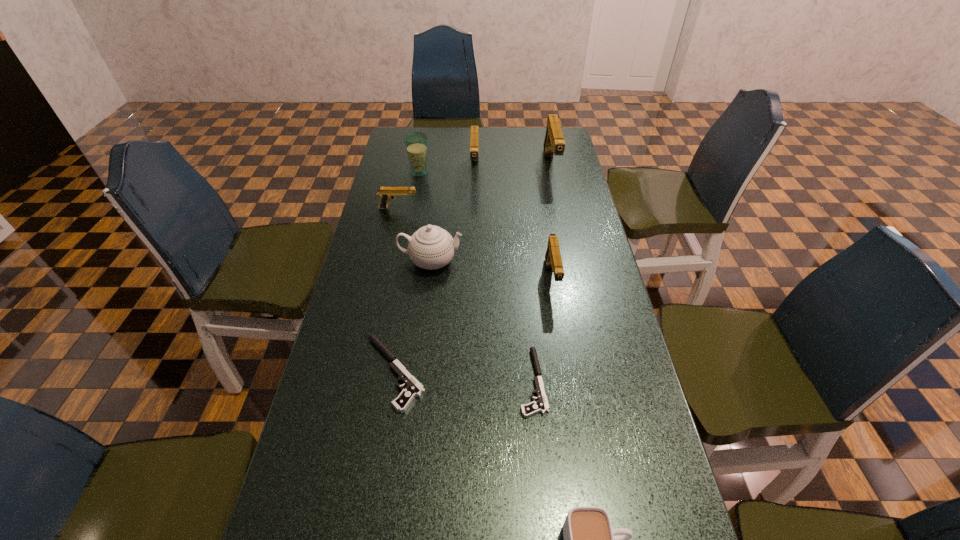
The image size is (960, 540). In the image, there is a desktop. Find the location of `vacant region at the far right corner`. vacant region at the far right corner is located at coordinates (544, 143).

You are a GUI agent. You are given a task and a screenshot of the screen. Output one action in this format:
    pyautogui.click(x=<x>, y=<y>)
    Task: Click on the vacant area that lies between the third tan pistol from left to right and the rightmost tan pistol
    
    Given the screenshot: What is the action you would take?
    pyautogui.click(x=551, y=223)

Locate an element on the screen. vacant space that is in between the fourth pistol from left to right and the third farthest pistol is located at coordinates (466, 295).

I want to click on free space between the bigger black pistol and the second biggest tan pistol, so click(x=435, y=271).

Identify the location of free space between the left black pistol and the second tan pistol from left to right. This screenshot has height=540, width=960. click(x=435, y=271).

This screenshot has width=960, height=540. What are the coordinates of `unoccupied area between the third tan pistol from right to left and the chinaware` in the screenshot? It's located at (453, 215).

Locate an element on the screen. The width and height of the screenshot is (960, 540). free area in between the left black pistol and the glass is located at coordinates click(407, 272).

Locate which object is the closest to the eighth tallest object. Please provide its 2D coordinates. Your answer should be formatted as a tuple, i.e. [(x, y)], where the tuple contains the x and y coordinates of a point satisfying the conditions above.

[(431, 247)]

Image resolution: width=960 pixels, height=540 pixels. Find the location of `the closest object to the glass`. the closest object to the glass is located at coordinates (474, 136).

Identify which pistol is the fifth closest to the glass. Please provide its 2D coordinates. Your answer should be formatted as a tuple, i.e. [(x, y)], where the tuple contains the x and y coordinates of a point satisfying the conditions above.

[(413, 389)]